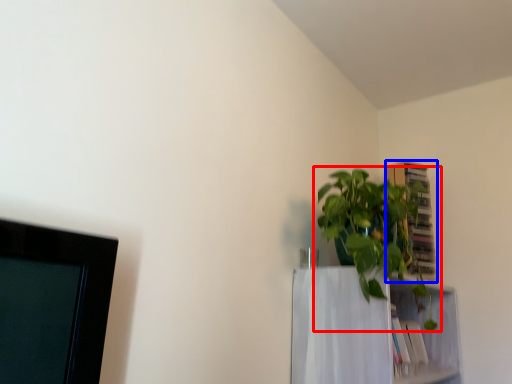
Question: Which point is closer to the camera, houseplant (highlighted by a red box) or cabinet (highlighted by a blue box)?

Choices:
 (A) houseplant
 (B) cabinet

Answer: (A)